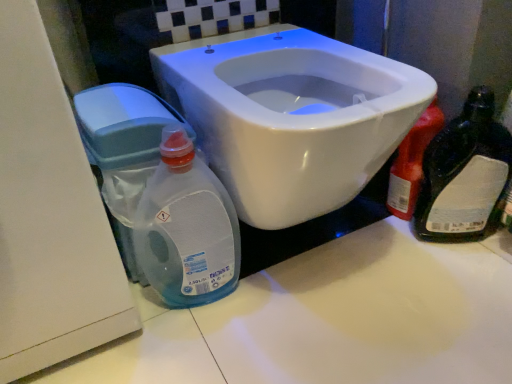
You are a GUI agent. You are given a task and a screenshot of the screen. Output one action in this format:
    pyautogui.click(x=<x>, y=<y>)
    Task: Click on the vacant point to the right of transparent plastic bottle at lower left
    
    Given the screenshot: What is the action you would take?
    pyautogui.click(x=293, y=291)